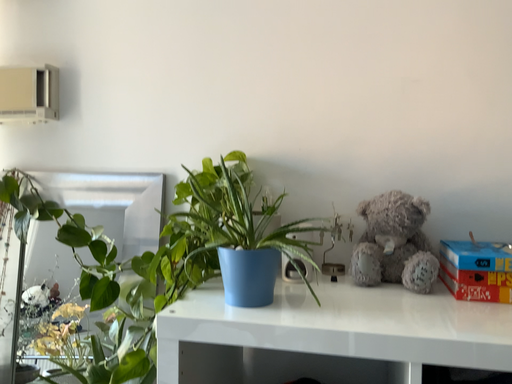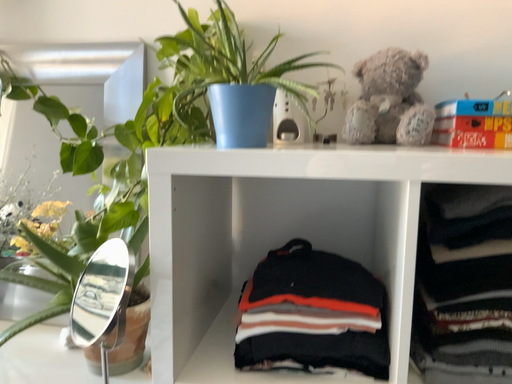
Question: Which way did the camera rotate in the video?

Choices:
 (A) rotated downward
 (B) rotated upward

Answer: (A)